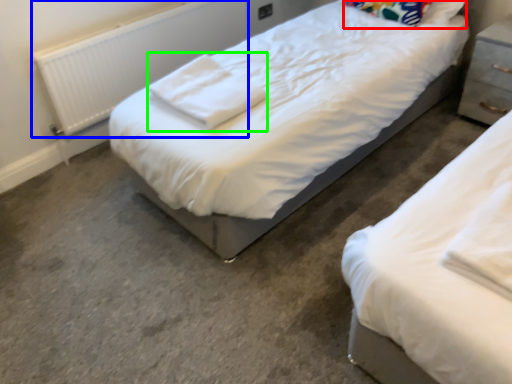
Question: Estimate the real-world distances between objects in this image. Which object is closer to pillow (highlighted by a red box), radiator (highlighted by a blue box) or cloth (highlighted by a green box)?

Choices:
 (A) radiator
 (B) cloth

Answer: (B)